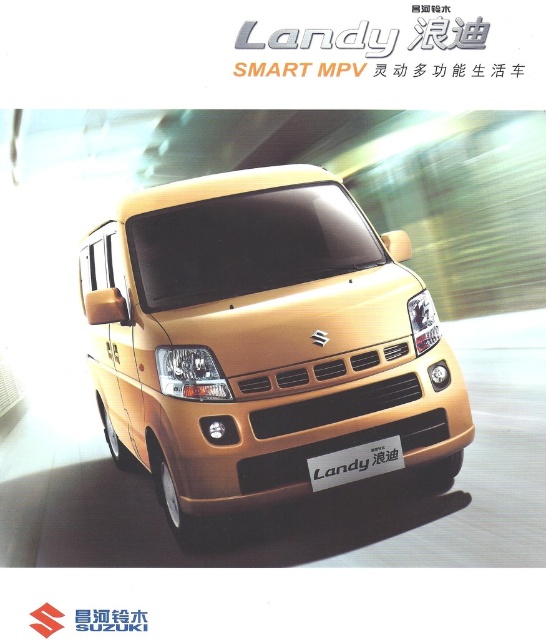
Between point (192, 465) and point (333, 483), which one is positioned in front?

Point (333, 483) is in front.

Who is higher up, gold metallic van at center or silver metallic plate at center?

Positioned higher is gold metallic van at center.

The image size is (546, 640). Find the location of `gold metallic van at center`. gold metallic van at center is located at coordinates (260, 339).